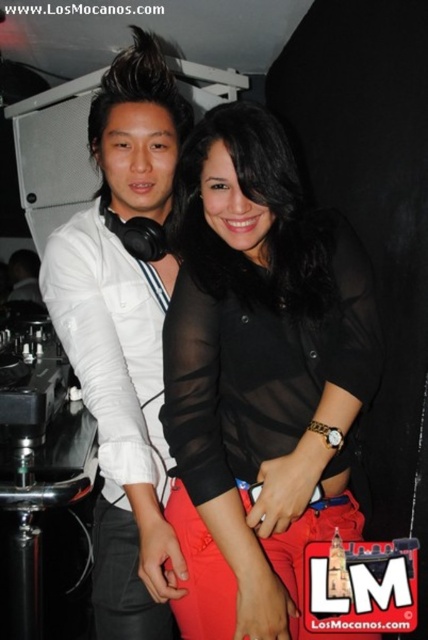
Does sheer black blouse at center have a lesser height compared to white matte shirt at left?

Indeed, sheer black blouse at center has a lesser height compared to white matte shirt at left.

Who is lower down, sheer black blouse at center or white matte shirt at left?

sheer black blouse at center is below.

Where is `sheer black blouse at center`? The image size is (428, 640). sheer black blouse at center is located at coordinates (259, 378).